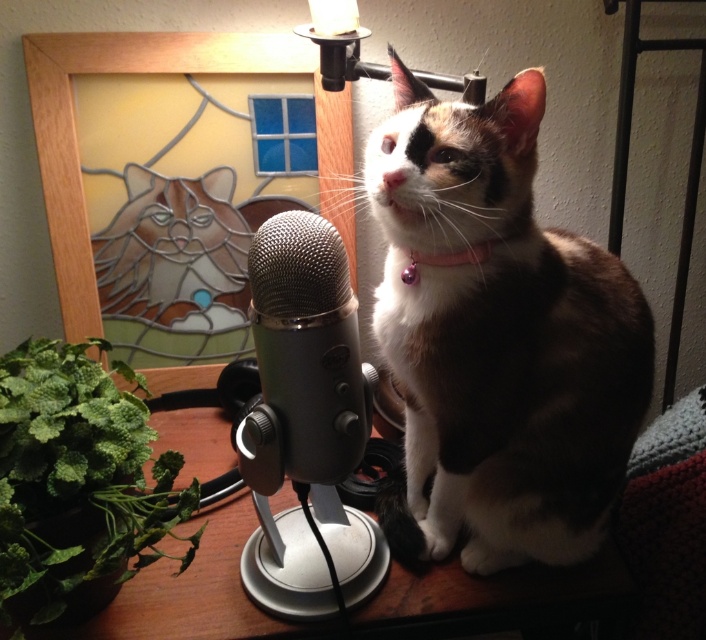
Between calico fur cat at center and wooden table at center, which one appears on the right side from the viewer's perspective?

calico fur cat at center is more to the right.

Is point (465, 109) farther from viewer compared to point (169, 442)?

No, (465, 109) is closer to viewer.

In order to click on calico fur cat at center in this screenshot , I will do `click(498, 339)`.

Does point (210, 461) lie in front of point (258, 472)?

That is False.

Who is shorter, wooden table at center or satin silver microphone at center?

With less height is satin silver microphone at center.

Find the location of a particular element. Image resolution: width=706 pixels, height=640 pixels. wooden table at center is located at coordinates (496, 598).

Which is below, calico fur cat at center or satin silver microphone at center?

satin silver microphone at center

Based on the photo, does calico fur cat at center have a greater width compared to satin silver microphone at center?

Correct, the width of calico fur cat at center exceeds that of satin silver microphone at center.

Is point (598, 284) farther from camera compared to point (333, 273)?

Yes, it is.

Find the location of a particular element. This screenshot has width=706, height=640. calico fur cat at center is located at coordinates (498, 339).